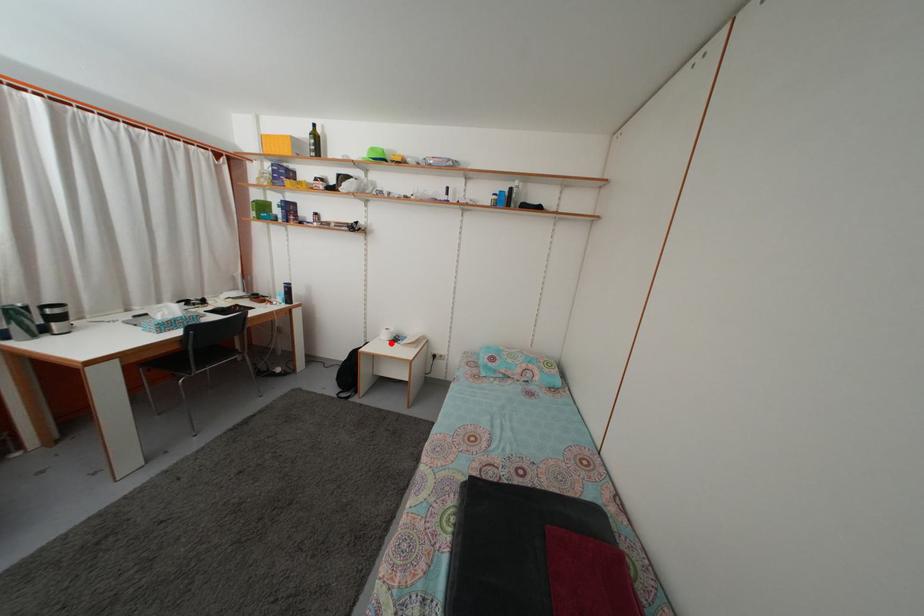
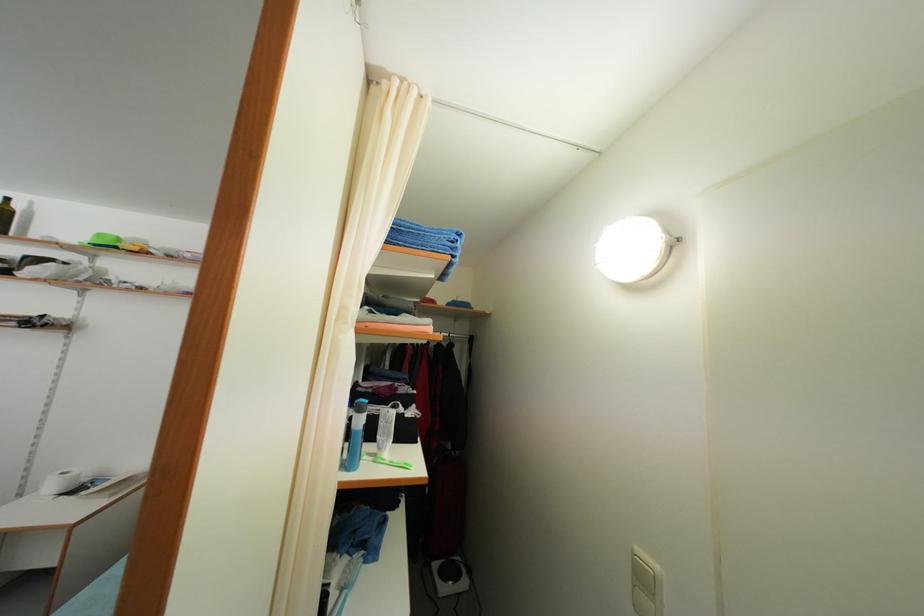
The point at the highlighted location is marked in the first image. Where is the corresponding point in the second image?

(56, 493)